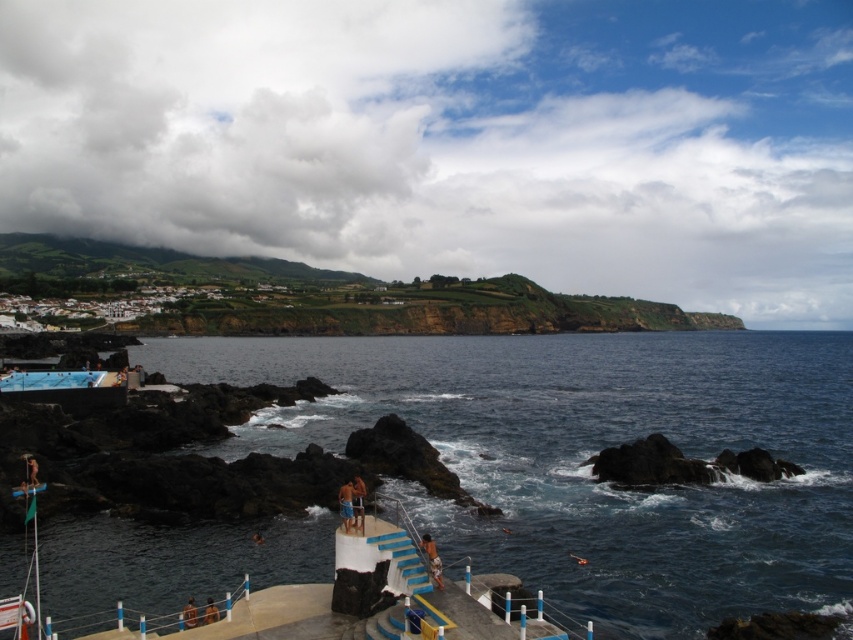
Question: Where is brown leather surfboard at lower center located in relation to brown fabric shorts at lower center in the image?

Choices:
 (A) below
 (B) above

Answer: (B)

Question: Where is tan skin person at center located in relation to brown leather surfboard at lower center in the image?

Choices:
 (A) right
 (B) left

Answer: (A)

Question: Among these points, which one is nearest to the camera?

Choices:
 (A) tap(218, 612)
 (B) tap(357, 508)

Answer: (A)

Question: Can you confirm if tan skin person at lower center is positioned below brown leather surfboard at lower center?

Choices:
 (A) no
 (B) yes

Answer: (A)

Question: Which point is farther to the camera?

Choices:
 (A) (344, 484)
 (B) (569, 346)
 (C) (354, 509)

Answer: (B)

Question: Which point is closer to the camera taking this photo?

Choices:
 (A) (270, 540)
 (B) (344, 509)
 (C) (432, 563)

Answer: (B)